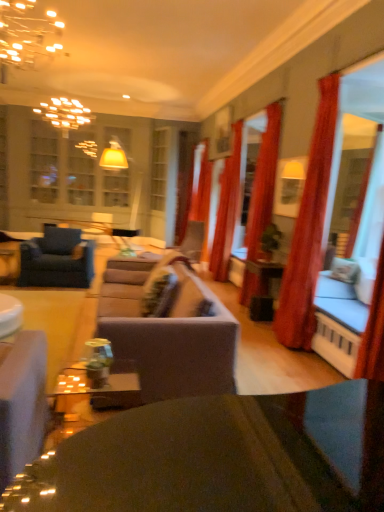
Question: Considering the positions of velvet blue armchair at left and gold metallic chandelier at upper left in the image, is velvet blue armchair at left wider or thinner than gold metallic chandelier at upper left?

Choices:
 (A) wide
 (B) thin

Answer: (A)

Question: Is point (79, 283) positioned closer to the camera than point (4, 50)?

Choices:
 (A) farther
 (B) closer

Answer: (A)

Question: Considering the real-world distances, which object is closest to the velvet red curtain at center, the 2th curtain in the back-to-front sequence?

Choices:
 (A) velvet red curtain at right, the 1th curtain when ordered from front to back
 (B) velvet blue armchair at left
 (C) shiny black table at center, marked as the second table in a back-to-front arrangement
 (D) red velvet curtain at right, acting as the 2th curtain starting from the front
 (E) white glossy bowl at lower left, which is the 1th table from left to right

Answer: (D)

Question: Which object is the farthest from the gold metallic chandelier at upper left?

Choices:
 (A) velvet grey couch at right
 (B) suede-like gray couch at center
 (C) white glossy bowl at lower left, which is the 1th table from left to right
 (D) velvet red curtain at right, the fourth curtain in the back-to-front sequence
 (E) matte orange curtain at center, placed as the 1th curtain when sorted from back to front

Answer: (A)